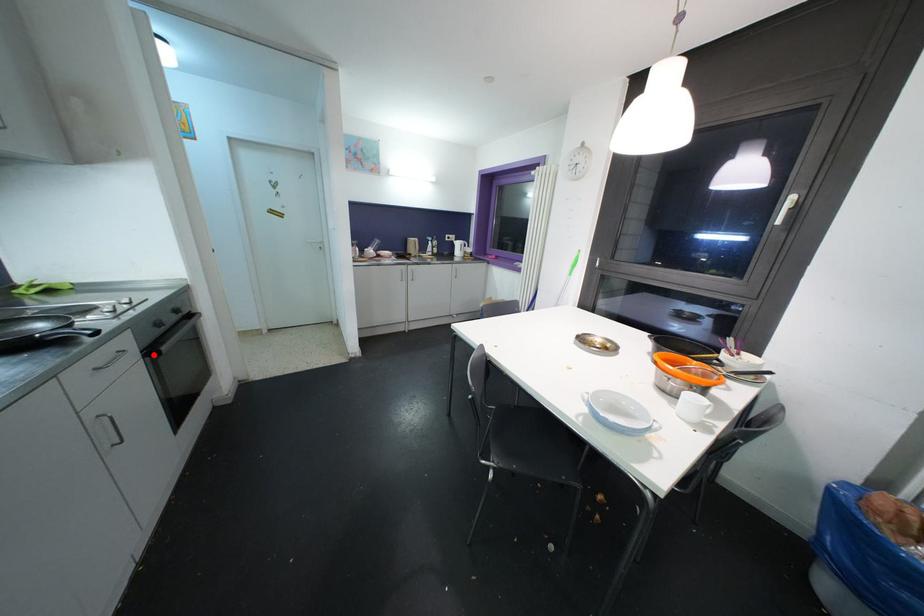
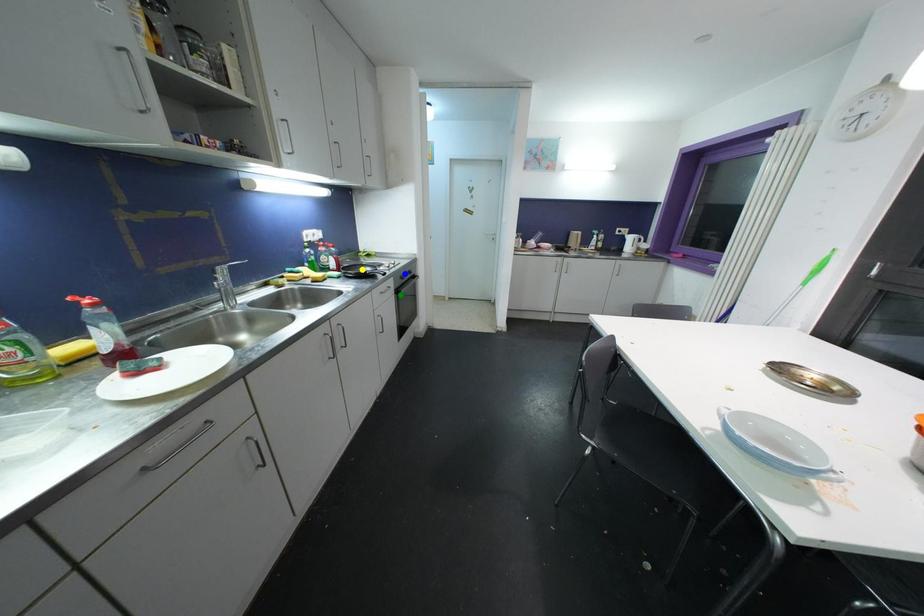
Question: I am providing you with two images of the same scene from different viewpoints. A red point is marked on the first image. You are given multiple points on the second image. In image 2, which mark is for the same physical point as the one in image 1?

Choices:
 (A) green point
 (B) blue point
 (C) yellow point

Answer: (A)